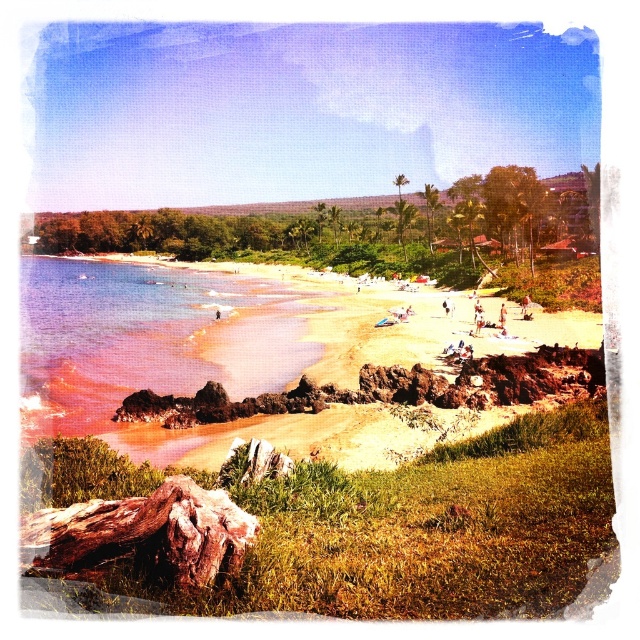
Can you confirm if smooth sand beach at center is bigger than pink sand at beach left?

No, smooth sand beach at center is not bigger than pink sand at beach left.

Which of these two, smooth sand beach at center or pink sand at beach left, stands taller?

pink sand at beach left

Between point (161, 304) and point (196, 442), which one is positioned behind?

Positioned behind is point (161, 304).

This screenshot has width=640, height=640. I want to click on smooth sand beach at center, so click(268, 364).